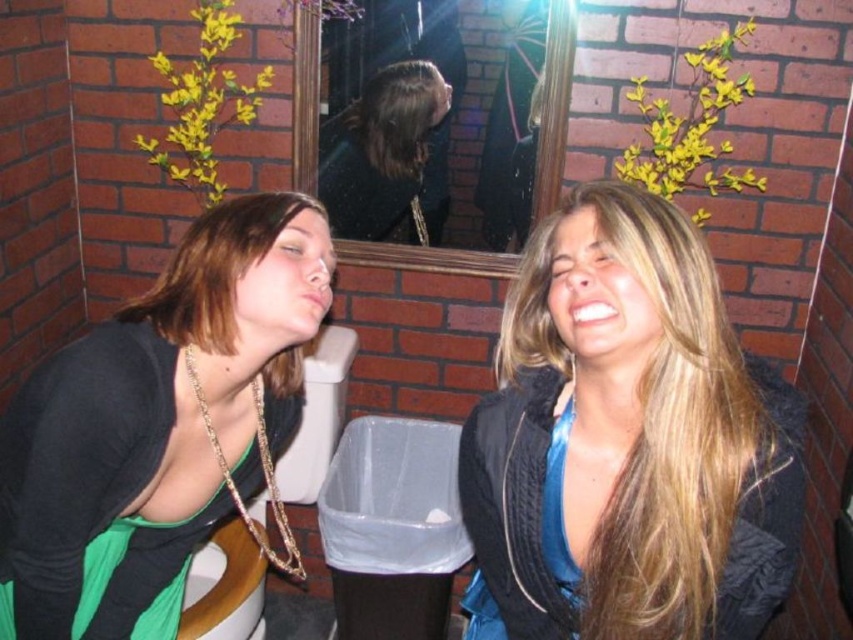
You are a fashion designer observing the image. You notice the blue satin blouse at center and the shiny black hair at center. Which item is located lower in the scene?

The blue satin blouse at center is positioned under the shiny black hair at center, so the blue satin blouse at center is lower in the scene.

You are a fashion designer observing the scene. You notice the green fabric top at left and the shiny black hair at center. Which clothing item is positioned to the left of the hair?

The green fabric top at left is positioned on the left side of shiny black hair at center.

You are a fashion designer observing two outfits in a restroom scene. The blue satin blouse at center and the green fabric top at left are displayed. Which of the two has a shorter length?

The blue satin blouse at center has a lesser height compared to the green fabric top at left, so the blue satin blouse at center is shorter in length.